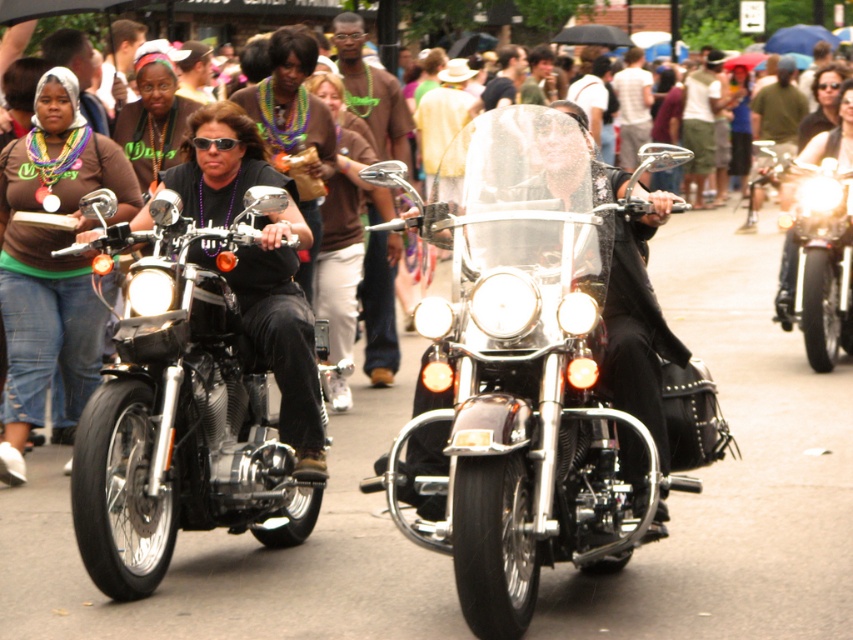
You are a photographer standing in the middle of the street. You want to take a photo of both shiny chrome motorcycle at center and shiny chrome motorcycle at left. Which motorcycle should you position closer to the camera to ensure both are fully visible in the frame?

You should position the shiny chrome motorcycle at center closer to the camera because it is wider than the shiny chrome motorcycle at left. This way, the wider motorcycle will take up more space in the frame, allowing both motorcycles to be fully visible without cropping either of them.

You are a photographer standing at the center of the street. You want to capture a photo of the shiny chrome motorcycle at center. Where should you aim your camera?

You should aim your camera at point 0.591 on the x axis and point 0.614 on the y axis to capture the shiny chrome motorcycle at center.

Based on the photo, you are a photographer trying to capture both shiny chrome motorcycle at center and shiny chrome motorcycle at left in a single frame. Based on their positions, which motorcycle should you adjust your camera to focus on first to ensure both are in the shot?

Since the shiny chrome motorcycle at center is to the right of the shiny chrome motorcycle at left, you should focus on the shiny chrome motorcycle at left first to ensure both are included in the frame.